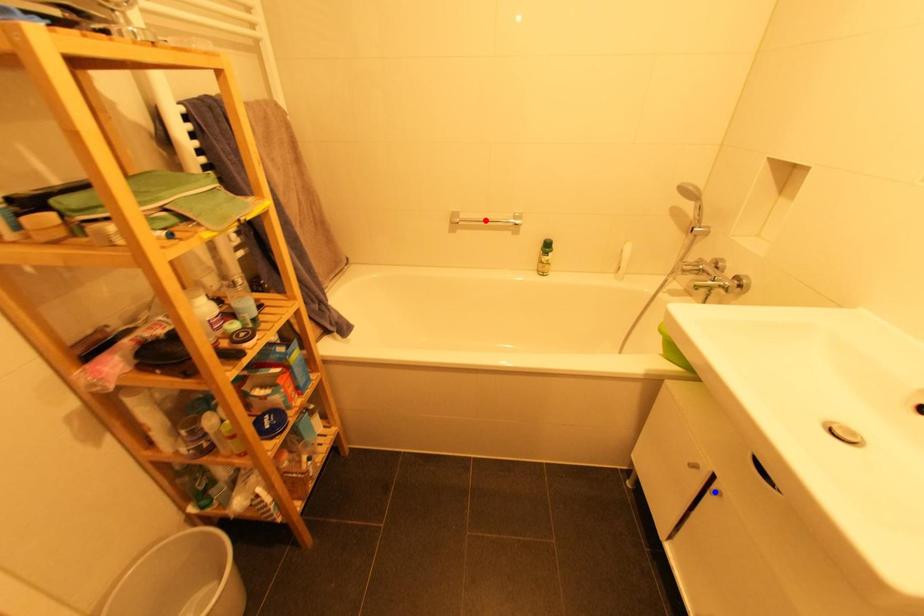
Question: Two points are marked on the image. Which point is closer to the camera?

Choices:
 (A) Blue point is closer.
 (B) Red point is closer.

Answer: (A)